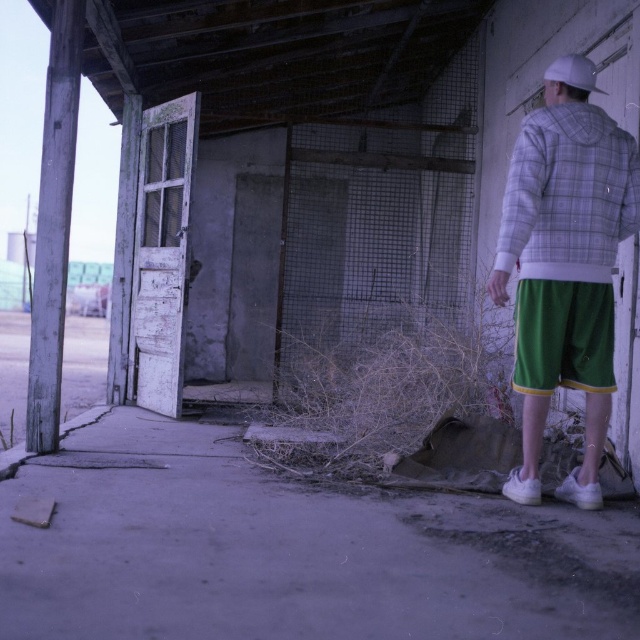
Question: Can you confirm if white plaid hoodie at right is bigger than green cotton shorts at right?

Choices:
 (A) yes
 (B) no

Answer: (A)

Question: Considering the real-world distances, which object is closest to the green cotton shorts at right?

Choices:
 (A) white matte baseball hat at upper right
 (B) white plaid hoodie at right

Answer: (B)

Question: Can you confirm if white plaid hoodie at right is thinner than green cotton shorts at right?

Choices:
 (A) no
 (B) yes

Answer: (A)

Question: Which of the following is the closest to the observer?

Choices:
 (A) white matte baseball hat at upper right
 (B) white plaid hoodie at right

Answer: (B)

Question: Which of the following is the closest to the observer?

Choices:
 (A) white plaid hoodie at right
 (B) white matte baseball hat at upper right
 (C) green cotton shorts at right

Answer: (A)

Question: Can you confirm if white plaid hoodie at right is positioned to the right of white matte baseball hat at upper right?

Choices:
 (A) yes
 (B) no

Answer: (B)